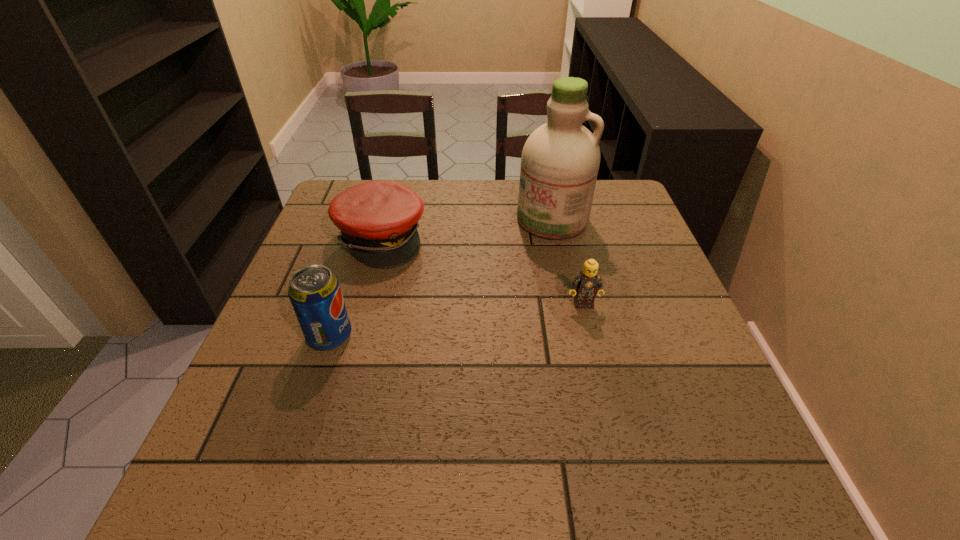
This screenshot has width=960, height=540. In the image, there is a desktop. Find the location of `free region at the far edge`. free region at the far edge is located at coordinates (465, 195).

The width and height of the screenshot is (960, 540). In order to click on vacant space at the near edge of the desktop in this screenshot , I will do [496, 409].

Where is `vacant point at the left edge`? The width and height of the screenshot is (960, 540). vacant point at the left edge is located at coordinates (288, 315).

In the image, there is a desktop. Identify the location of vacant space at the right edge. This screenshot has height=540, width=960. (624, 228).

At what (x,y) coordinates should I click in order to perform the action: click on free point at the far right corner. Please return your answer as a coordinate pair (x, y). This screenshot has height=540, width=960. Looking at the image, I should click on (616, 207).

Locate an element on the screen. vacant area at the near right corner of the desktop is located at coordinates (673, 426).

This screenshot has width=960, height=540. I want to click on vacant space in between the soda and the cap, so 355,287.

I want to click on vacant space in between the cap and the cleansing agent, so click(467, 229).

Where is `free area in between the third shortest object and the Lego`? The image size is (960, 540). free area in between the third shortest object and the Lego is located at coordinates (456, 320).

In order to click on vacant area between the cap and the tallest object in this screenshot , I will do `click(467, 229)`.